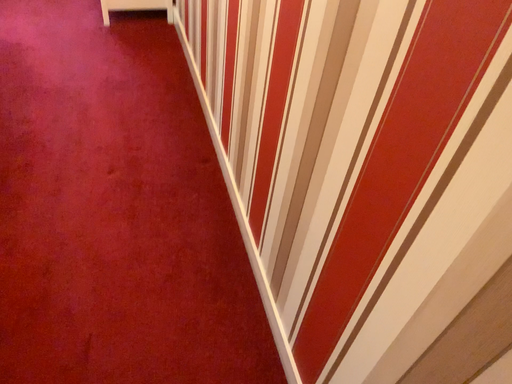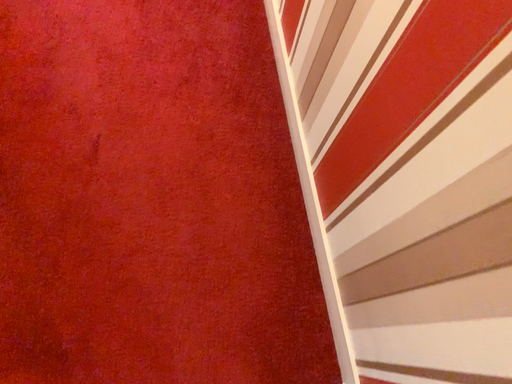
Question: How did the camera likely rotate when shooting the video?

Choices:
 (A) rotated downward
 (B) rotated upward

Answer: (A)